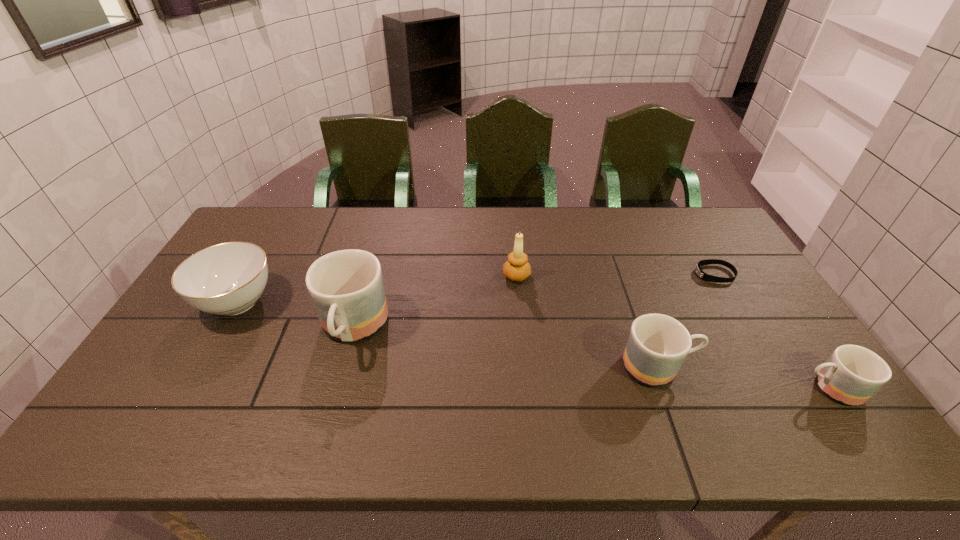
Find the location of a particular element. mug that is at the right edge is located at coordinates (852, 374).

Find the location of a particular element. Image resolution: width=960 pixels, height=540 pixels. wristband present at the right edge is located at coordinates (706, 277).

The image size is (960, 540). What are the coordinates of `object present at the near right corner` in the screenshot? It's located at (852, 374).

What are the coordinates of `vacant space at the far edge of the desktop` in the screenshot? It's located at (651, 235).

At what (x,y) coordinates should I click in order to perform the action: click on vacant space at the near edge of the desktop. Please return your answer as a coordinate pair (x, y). This screenshot has height=540, width=960. Looking at the image, I should click on (608, 381).

In the image, there is a desktop. Where is `vacant space at the right edge`? The image size is (960, 540). vacant space at the right edge is located at coordinates (762, 302).

Locate an element on the screen. This screenshot has width=960, height=540. vacant space at the far left corner is located at coordinates coord(284,206).

Where is `vacant point at the far right corner`? The width and height of the screenshot is (960, 540). vacant point at the far right corner is located at coordinates (708, 231).

Locate an element on the screen. Image resolution: width=960 pixels, height=540 pixels. vacant area that lies between the shortest object and the candle_holder is located at coordinates (615, 275).

This screenshot has width=960, height=540. I want to click on free space between the leftmost mug and the third object from left to right, so click(x=435, y=302).